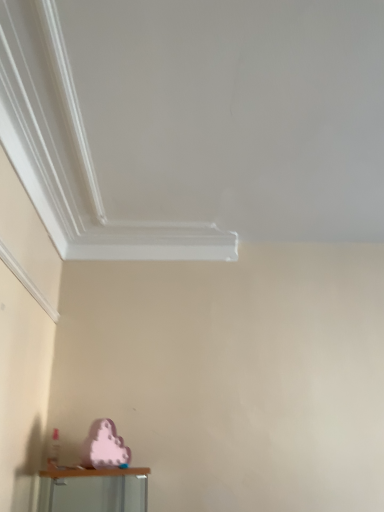
Locate an element on the screen. pink matte cloud at lower left is located at coordinates (104, 446).

Measure the distance between point (110, 433) and camera.

A distance of 1.94 meters exists between point (110, 433) and camera.

Image resolution: width=384 pixels, height=512 pixels. Describe the element at coordinates (104, 446) in the screenshot. I see `pink matte cloud at lower left` at that location.

What is the approximate height of pink matte cloud at lower left?

21.63 centimeters.

Find the location of `pink matte cloud at lower left`. pink matte cloud at lower left is located at coordinates (104, 446).